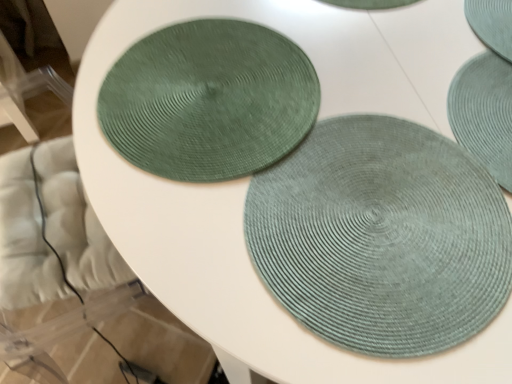
Question: Is sage green woven mat at center, placed as the second mat when sorted from back to front, positioned with its back to green woven coaster at upper left, arranged as the 2th coaster when viewed from the right?

Choices:
 (A) yes
 (B) no

Answer: (B)

Question: Considering the relative sizes of sage green woven mat at center, placed as the second mat when sorted from back to front, and green woven coaster at upper left, arranged as the 2th coaster when viewed from the right, in the image provided, is sage green woven mat at center, placed as the second mat when sorted from back to front, taller than green woven coaster at upper left, arranged as the 2th coaster when viewed from the right,?

Choices:
 (A) yes
 (B) no

Answer: (A)

Question: Considering the relative positions of sage green woven mat at center, arranged as the 1th mat when viewed from the front, and green woven coaster at upper left, the 1th coaster when ordered from left to right, in the image provided, is sage green woven mat at center, arranged as the 1th mat when viewed from the front, to the right of green woven coaster at upper left, the 1th coaster when ordered from left to right, from the viewer's perspective?

Choices:
 (A) yes
 (B) no

Answer: (A)

Question: Are sage green woven mat at center, arranged as the 1th mat when viewed from the front, and green woven coaster at upper left, arranged as the 2th coaster when viewed from the right, located far from each other?

Choices:
 (A) yes
 (B) no

Answer: (B)

Question: Does sage green woven mat at center, arranged as the 1th mat when viewed from the front, have a smaller size compared to green woven coaster at upper left, arranged as the 2th coaster when viewed from the right?

Choices:
 (A) no
 (B) yes

Answer: (A)

Question: From a real-world perspective, does sage green woven mat at center, arranged as the 1th mat when viewed from the front, stand above green woven coaster at upper left, the 1th coaster when ordered from left to right?

Choices:
 (A) yes
 (B) no

Answer: (B)

Question: Can you confirm if sage green woven mat at center, placed as the second mat when sorted from back to front, is shorter than sage green woven mat at center, placed as the second mat when sorted from front to back?

Choices:
 (A) no
 (B) yes

Answer: (A)

Question: Is sage green woven mat at center, placed as the second mat when sorted from back to front, looking in the opposite direction of sage green woven mat at center, placed as the second mat when sorted from front to back?

Choices:
 (A) no
 (B) yes

Answer: (A)

Question: Is sage green woven mat at center, arranged as the 1th mat when viewed from the front, smaller than sage green woven mat at center, positioned as the 1th mat in back-to-front order?

Choices:
 (A) no
 (B) yes

Answer: (A)

Question: Is sage green woven mat at center, placed as the second mat when sorted from back to front, beside sage green woven mat at center, positioned as the 1th mat in back-to-front order?

Choices:
 (A) yes
 (B) no

Answer: (B)

Question: Is sage green woven mat at center, arranged as the 1th mat when viewed from the front, not inside sage green woven mat at center, positioned as the 1th mat in back-to-front order?

Choices:
 (A) yes
 (B) no

Answer: (A)

Question: From the image's perspective, is sage green woven mat at center, arranged as the 1th mat when viewed from the front, under sage green woven mat at center, positioned as the 1th mat in back-to-front order?

Choices:
 (A) yes
 (B) no

Answer: (A)

Question: Does sage green woven mat at center, positioned as the 1th mat in back-to-front order, have a greater height compared to teal woven coaster at upper right, positioned as the 2th coaster in left-to-right order?

Choices:
 (A) no
 (B) yes

Answer: (A)